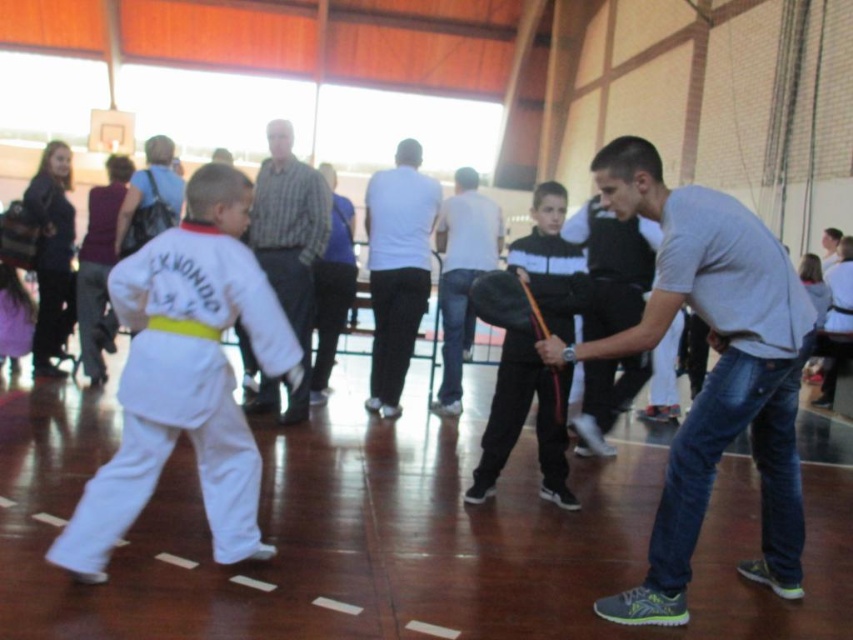
Question: Estimate the real-world distances between objects in this image. Which object is closer to the white matte shirt at center?

Choices:
 (A) gray cotton t-shirt at center
 (B) light gray shirt at center

Answer: (B)

Question: Which point is farther to the camera?

Choices:
 (A) (410, 170)
 (B) (554, 272)

Answer: (A)

Question: Can you confirm if gray cotton t-shirt at center is positioned to the left of light gray shirt at center?

Choices:
 (A) yes
 (B) no

Answer: (B)

Question: Can you confirm if white matte karate uniform at left is positioned below black matte jacket at center?

Choices:
 (A) no
 (B) yes

Answer: (B)

Question: Considering the real-world distances, which object is closest to the white matte karate uniform at left?

Choices:
 (A) white matte shirt at center
 (B) black matte jacket at center
 (C) light gray shirt at center

Answer: (B)

Question: Is white matte karate uniform at left in front of light gray shirt at center?

Choices:
 (A) no
 (B) yes

Answer: (B)